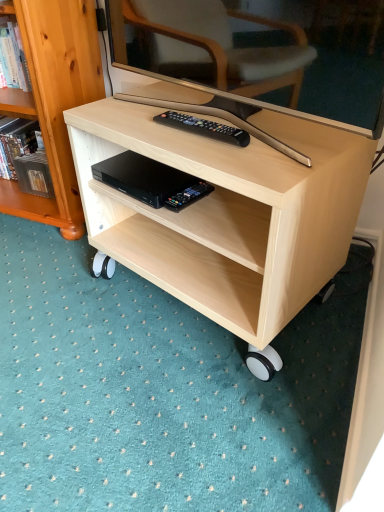
Question: Is there a large distance between black plastic remote at center and light wood desk at center?

Choices:
 (A) no
 (B) yes

Answer: (A)

Question: Can we say black plastic remote at center lies outside light wood desk at center?

Choices:
 (A) no
 (B) yes

Answer: (A)

Question: Is the position of black plastic remote at center less distant than that of light wood desk at center?

Choices:
 (A) no
 (B) yes

Answer: (A)

Question: Is black plastic remote at center placed right next to light wood desk at center?

Choices:
 (A) no
 (B) yes

Answer: (A)

Question: Does black plastic remote at center have a larger size compared to light wood desk at center?

Choices:
 (A) yes
 (B) no

Answer: (B)

Question: Can you confirm if black plastic remote at center is wider than light wood desk at center?

Choices:
 (A) yes
 (B) no

Answer: (B)

Question: From a real-world perspective, is light wood desk at center located beneath black plastic remote at center?

Choices:
 (A) yes
 (B) no

Answer: (A)

Question: Is black plastic remote at center at the back of light wood desk at center?

Choices:
 (A) no
 (B) yes

Answer: (A)

Question: Can you confirm if light wood desk at center is bigger than black plastic remote at center?

Choices:
 (A) yes
 (B) no

Answer: (A)

Question: Is light wood desk at center next to black plastic remote at center and touching it?

Choices:
 (A) yes
 (B) no

Answer: (B)

Question: From the image's perspective, is light wood desk at center over black plastic remote at center?

Choices:
 (A) no
 (B) yes

Answer: (A)

Question: Can you confirm if light wood desk at center is positioned to the left of black plastic remote at center?

Choices:
 (A) yes
 (B) no

Answer: (B)

Question: Is light wood desk at center completely or partially inside light wood/texture bookcase at left?

Choices:
 (A) no
 (B) yes

Answer: (A)